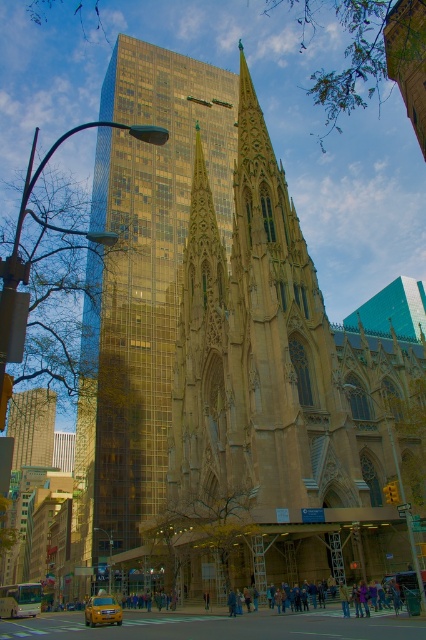
You are standing at the intersection point of the city street and want to take a photo of the gold glassy skyscraper at center. According to the coordinates provided, where exactly should you position yourself to capture the entire building in your camera frame?

The gold glassy skyscraper at center is located at coordinates point (141, 284), so you should position yourself directly in front of that point to capture the entire building in your camera frame.

You are an architect analyzing the urban layout of this city. You observe the gold glassy skyscraper at center and the gold glass skyscraper at center. Which of these two structures is positioned higher in the scene?

The gold glassy skyscraper at center is positioned higher than the gold glass skyscraper at center according to the description.